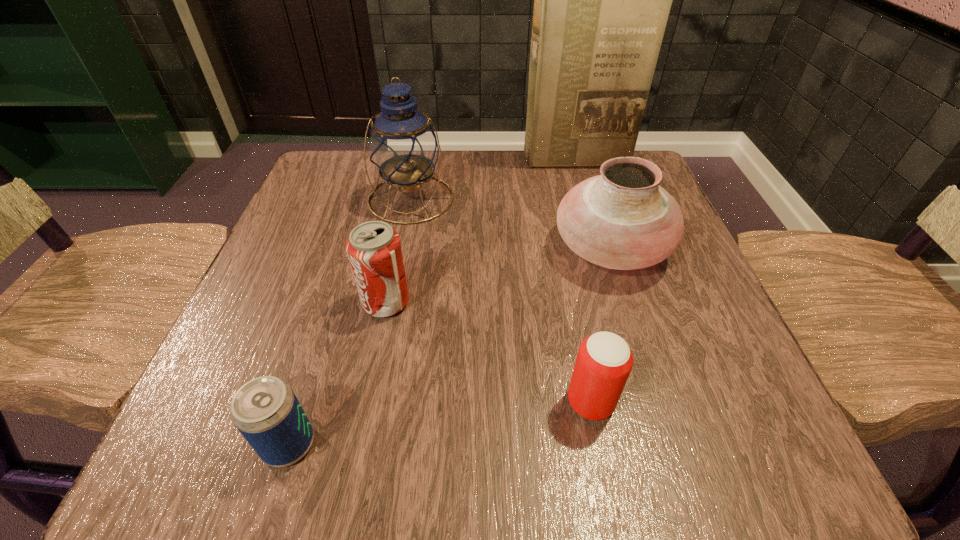
What are the coordinates of `object that is at the near left corner` in the screenshot? It's located at (265, 410).

In order to click on object at the far right corner in this screenshot , I will do `click(602, 0)`.

In the image, there is a desktop. In order to click on vacant space at the far edge in this screenshot , I will do `click(432, 184)`.

What are the coordinates of `free space at the near edge of the desktop` in the screenshot? It's located at (416, 428).

This screenshot has height=540, width=960. In the image, there is a desktop. Find the location of `vacant space at the left edge`. vacant space at the left edge is located at coordinates (341, 319).

Locate an element on the screen. This screenshot has height=540, width=960. vacant area at the right edge of the desktop is located at coordinates (640, 286).

Find the location of a particular element. This screenshot has height=540, width=960. vacant space at the far left corner is located at coordinates (298, 201).

In the image, there is a desktop. Where is `blank space at the near right corner`? The image size is (960, 540). blank space at the near right corner is located at coordinates [763, 435].

Locate an element on the screen. The height and width of the screenshot is (540, 960). vacant area that lies between the left beer can and the right beer can is located at coordinates (440, 423).

I want to click on vacant space in between the pottery and the lantern, so click(511, 223).